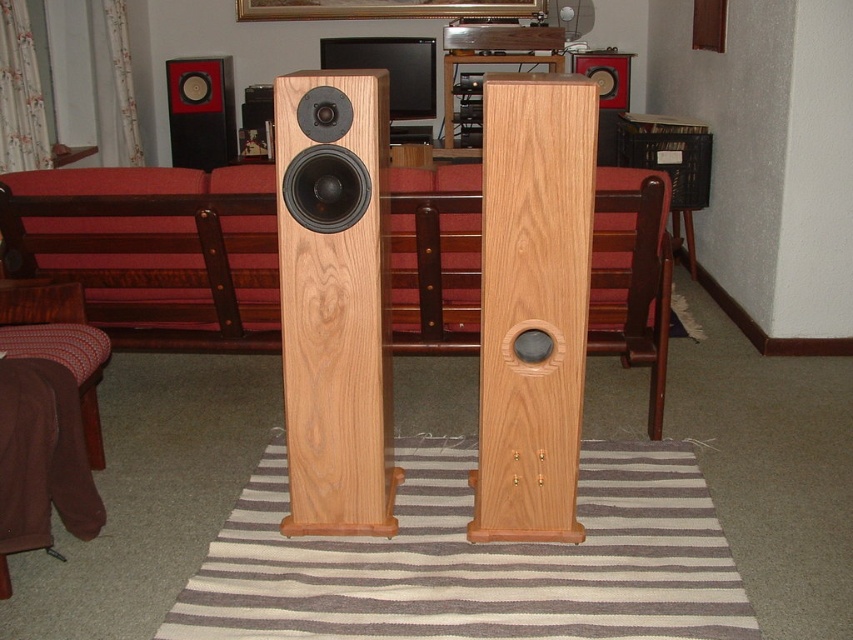
Question: Which of the following is the farthest from the observer?

Choices:
 (A) matte black speaker at upper center
 (B) matte black speaker at upper left
 (C) natural wood speaker at center

Answer: (B)

Question: Which point is closer to the camera taking this photo?

Choices:
 (A) (582, 54)
 (B) (178, 148)
 (C) (294, 451)

Answer: (C)

Question: Is natural wood speaker at center below matte black speaker at upper center?

Choices:
 (A) no
 (B) yes

Answer: (B)

Question: Does natural wood speaker at center appear under matte black speaker at upper center?

Choices:
 (A) no
 (B) yes

Answer: (B)

Question: Is natural wood speaker at center below matte black speaker at upper center?

Choices:
 (A) no
 (B) yes

Answer: (B)

Question: Which object is farther from the camera taking this photo?

Choices:
 (A) natural wood speaker at center
 (B) matte black speaker at upper center

Answer: (B)